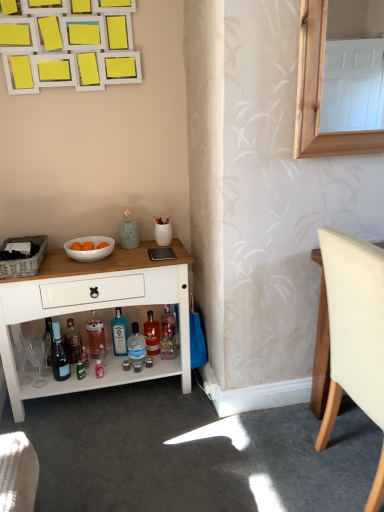
Where is `free space above white glossy bowl at center (from a real-world perspective)`? free space above white glossy bowl at center (from a real-world perspective) is located at coordinates (87, 245).